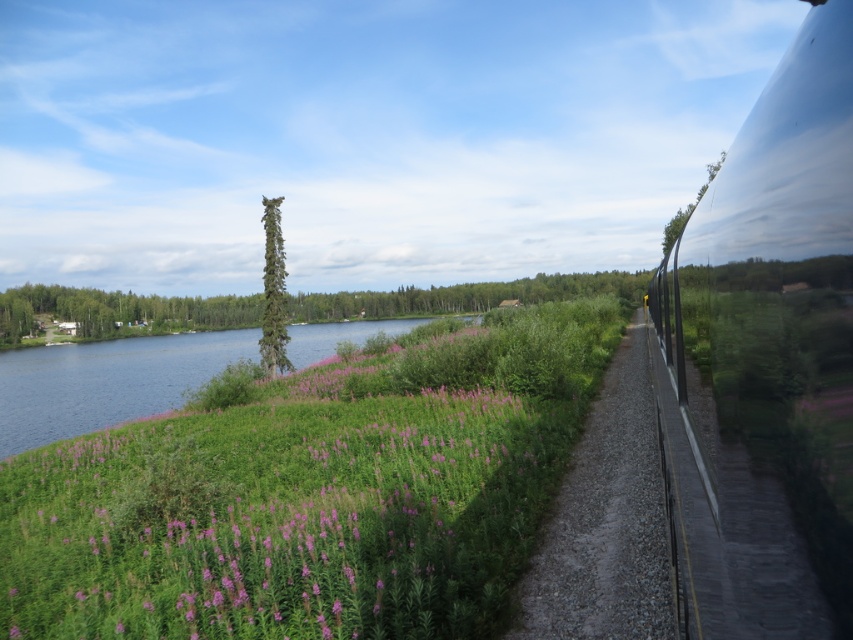
Question: Where is gravel path at right located in relation to green textured tree at center in the image?

Choices:
 (A) above
 (B) below

Answer: (B)

Question: Which of the following is the farthest from the observer?

Choices:
 (A) (1, 340)
 (B) (277, 236)
 (C) (814, 477)

Answer: (A)

Question: Which of the following is the farthest from the observer?

Choices:
 (A) glossy metallic train at right
 (B) green leafy tree at center
 (C) gravel path at right

Answer: (B)

Question: Is gravel path at right thinner than green textured tree at center?

Choices:
 (A) yes
 (B) no

Answer: (B)

Question: Which point is farther to the camera?

Choices:
 (A) green textured tree at center
 (B) green leafy tree at center

Answer: (B)

Question: In this image, where is gravel path at right located relative to green textured tree at center?

Choices:
 (A) right
 (B) left

Answer: (A)